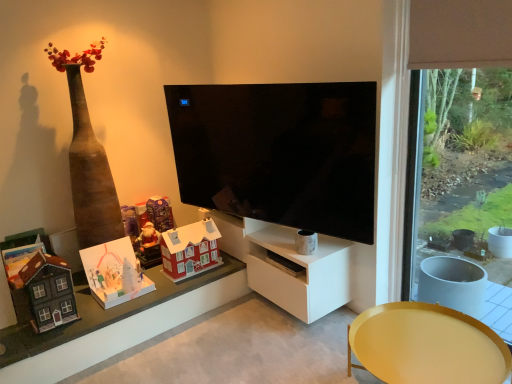
The width and height of the screenshot is (512, 384). I want to click on free area behind wooden house at lower left, the 1th toy when ordered from front to back, so click(x=86, y=300).